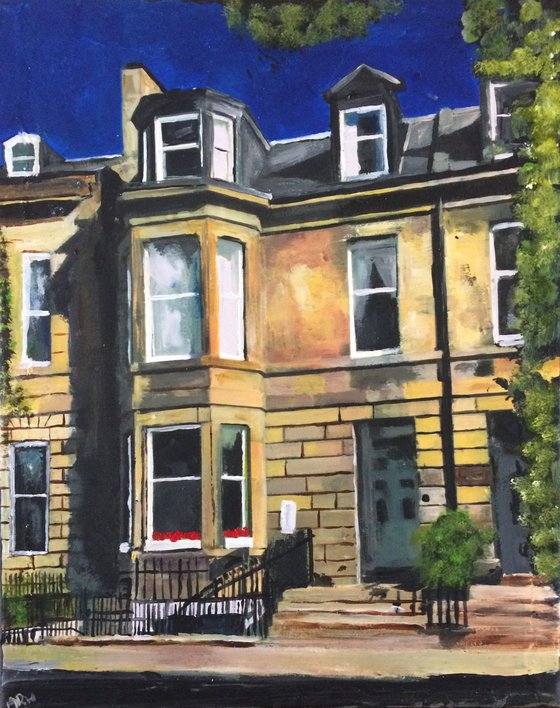
This screenshot has height=708, width=560. In order to click on black wrought iron railing, left and right of stairs, right of center, botttom in this screenshot , I will do `click(444, 615)`, `click(282, 565)`.